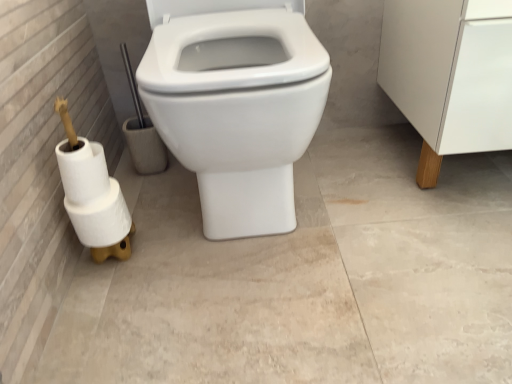
I want to click on vacant area that is in front of white matte toilet paper at left, which is the 2th toilet paper from top to bottom, so click(x=105, y=316).